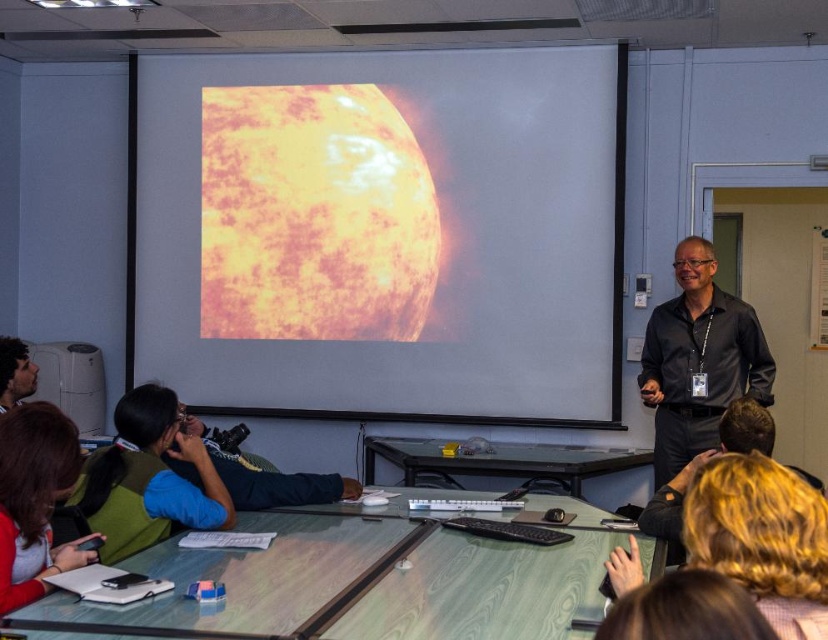
Consider the image. You are a photographer in the classroom and want to take a photo of the black shirt at right and the black shirt at center. Which one is closer to the camera?

→ The black shirt at right is positioned over the black shirt at center, so it is closer to the camera.

You are a student who needs to place a 1.5 meter long project board on the green wood table at lower center. Can you fit it on the table without overlapping the edges?

The green wood table at lower center is 1.74 meters long, so yes, the 1.5 meter project board can fit on it without overlapping the edges.